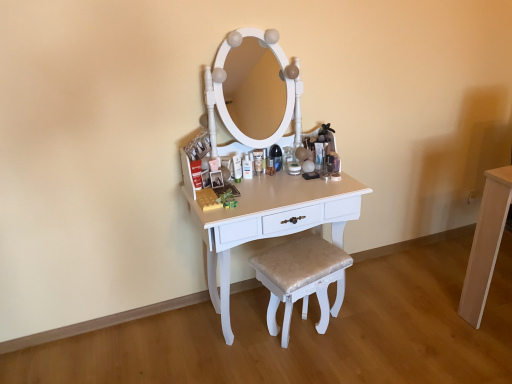
Question: From the image's perspective, does white glossy table at center, which appears as the 1th table when viewed from the left, appear higher than shiny beige cushioned stool at center?

Choices:
 (A) no
 (B) yes

Answer: (B)

Question: Can you confirm if white glossy table at center, which appears as the 1th table when viewed from the left, is smaller than shiny beige cushioned stool at center?

Choices:
 (A) no
 (B) yes

Answer: (A)

Question: Is white glossy table at center, which appears as the 1th table when viewed from the left, not close to shiny beige cushioned stool at center?

Choices:
 (A) yes
 (B) no

Answer: (B)

Question: Is white glossy table at center, which appears as the 1th table when viewed from the left, facing towards shiny beige cushioned stool at center?

Choices:
 (A) yes
 (B) no

Answer: (A)

Question: Is the position of white glossy table at center, which appears as the 1th table when viewed from the left, more distant than that of shiny beige cushioned stool at center?

Choices:
 (A) yes
 (B) no

Answer: (B)

Question: Is white glossy table at center, the 2th table in the right-to-left sequence, wider or thinner than shiny beige cushioned stool at center?

Choices:
 (A) thin
 (B) wide

Answer: (B)

Question: Is white glossy table at center, the 2th table in the right-to-left sequence, inside the boundaries of shiny beige cushioned stool at center, or outside?

Choices:
 (A) outside
 (B) inside

Answer: (A)

Question: From their relative heights in the image, would you say white glossy table at center, which appears as the 1th table when viewed from the left, is taller or shorter than shiny beige cushioned stool at center?

Choices:
 (A) short
 (B) tall

Answer: (B)

Question: Does point (330, 188) appear closer or farther from the camera than point (321, 324)?

Choices:
 (A) closer
 (B) farther

Answer: (A)

Question: Considering the positions of matte white lotion at center and shiny beige cushioned stool at center in the image, is matte white lotion at center taller or shorter than shiny beige cushioned stool at center?

Choices:
 (A) tall
 (B) short

Answer: (B)

Question: From the image's perspective, is matte white lotion at center located above or below shiny beige cushioned stool at center?

Choices:
 (A) below
 (B) above

Answer: (B)

Question: Would you say matte white lotion at center is inside or outside shiny beige cushioned stool at center?

Choices:
 (A) inside
 (B) outside

Answer: (B)

Question: In terms of size, does matte white lotion at center appear bigger or smaller than shiny beige cushioned stool at center?

Choices:
 (A) small
 (B) big

Answer: (A)

Question: Choose the correct answer: Is shiny beige cushioned stool at center inside matte white lotion at center or outside it?

Choices:
 (A) outside
 (B) inside

Answer: (A)

Question: In terms of width, does shiny beige cushioned stool at center look wider or thinner when compared to matte white lotion at center?

Choices:
 (A) wide
 (B) thin

Answer: (A)